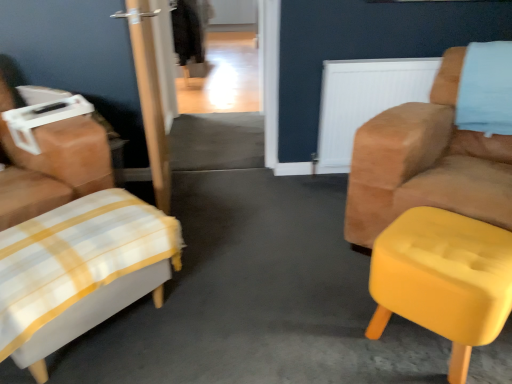
Question: From a real-world perspective, is suede tan armchair at right, which ranks as the second chair in left-to-right order, below yellow fabric ottoman at right, arranged as the second furniture when viewed from the left?

Choices:
 (A) yes
 (B) no

Answer: (B)

Question: Would you say suede tan armchair at right, which ranks as the second chair in left-to-right order, contains yellow fabric ottoman at right, arranged as the second furniture when viewed from the left?

Choices:
 (A) yes
 (B) no

Answer: (B)

Question: From a real-world perspective, is suede tan armchair at right, the 1th chair when ordered from right to left, on yellow fabric ottoman at right, which appears as the first furniture when viewed from the right?

Choices:
 (A) yes
 (B) no

Answer: (A)

Question: Considering the relative positions of suede tan armchair at right, which ranks as the second chair in left-to-right order, and yellow fabric ottoman at right, arranged as the second furniture when viewed from the left, in the image provided, is suede tan armchair at right, which ranks as the second chair in left-to-right order, behind yellow fabric ottoman at right, arranged as the second furniture when viewed from the left,?

Choices:
 (A) no
 (B) yes

Answer: (B)

Question: Would you say suede tan armchair at right, the 1th chair when ordered from right to left, is a long distance from yellow fabric ottoman at right, arranged as the second furniture when viewed from the left?

Choices:
 (A) no
 (B) yes

Answer: (A)

Question: Considering the relative sizes of suede tan armchair at right, the 1th chair when ordered from right to left, and yellow fabric ottoman at right, which appears as the first furniture when viewed from the right, in the image provided, is suede tan armchair at right, the 1th chair when ordered from right to left, taller than yellow fabric ottoman at right, which appears as the first furniture when viewed from the right,?

Choices:
 (A) yes
 (B) no

Answer: (A)

Question: Could white fabric ottoman at left, which ranks as the second chair in right-to-left order, be considered to be inside white textured radiator at upper right?

Choices:
 (A) yes
 (B) no

Answer: (B)

Question: Is white textured radiator at upper right smaller than white fabric ottoman at left, placed as the first chair when sorted from left to right?

Choices:
 (A) yes
 (B) no

Answer: (A)

Question: Is there a large distance between white textured radiator at upper right and white fabric ottoman at left, which ranks as the second chair in right-to-left order?

Choices:
 (A) no
 (B) yes

Answer: (B)

Question: Considering the relative positions of white textured radiator at upper right and white fabric ottoman at left, which ranks as the second chair in right-to-left order, in the image provided, is white textured radiator at upper right to the right of white fabric ottoman at left, which ranks as the second chair in right-to-left order, from the viewer's perspective?

Choices:
 (A) yes
 (B) no

Answer: (A)

Question: Would you say white textured radiator at upper right is outside white fabric ottoman at left, which ranks as the second chair in right-to-left order?

Choices:
 (A) no
 (B) yes

Answer: (B)

Question: From the image's perspective, is white textured radiator at upper right on white fabric ottoman at left, placed as the first chair when sorted from left to right?

Choices:
 (A) yes
 (B) no

Answer: (A)

Question: Considering the relative sizes of white fabric ottoman at left, placed as the first chair when sorted from left to right, and white plaid ottoman at lower left, which is counted as the 1th furniture, starting from the left, in the image provided, is white fabric ottoman at left, placed as the first chair when sorted from left to right, shorter than white plaid ottoman at lower left, which is counted as the 1th furniture, starting from the left,?

Choices:
 (A) yes
 (B) no

Answer: (B)